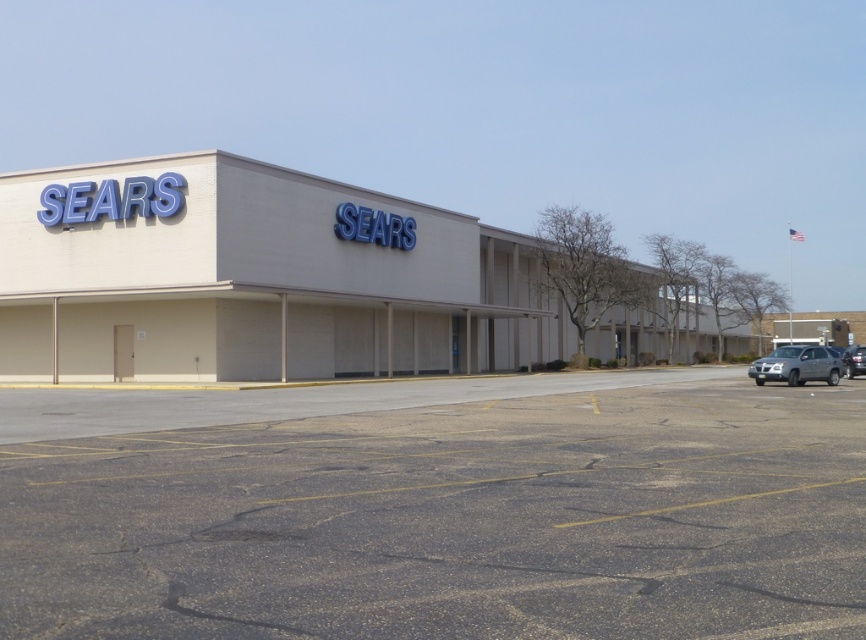
Question: Is beige/smooth building at center smaller than shiny silver suv at right?

Choices:
 (A) yes
 (B) no

Answer: (B)

Question: Considering the real-world distances, which object is closest to the shiny silver suv at right?

Choices:
 (A) gray asphalt parking lot at lower center
 (B) beige/smooth building at center

Answer: (B)

Question: Which of the following is the closest to the observer?

Choices:
 (A) silver metallic suv at right
 (B) gray asphalt parking lot at lower center
 (C) shiny silver suv at right
 (D) beige/smooth building at center

Answer: (B)

Question: Which point is closer to the camera taking this photo?

Choices:
 (A) (689, 323)
 (B) (768, 372)
 (C) (662, 616)

Answer: (C)

Question: Considering the relative positions of silver metallic suv at right and shiny silver suv at right in the image provided, where is silver metallic suv at right located with respect to shiny silver suv at right?

Choices:
 (A) left
 (B) right

Answer: (A)

Question: From the image, what is the correct spatial relationship of beige/smooth building at center in relation to silver metallic suv at right?

Choices:
 (A) below
 (B) above

Answer: (B)